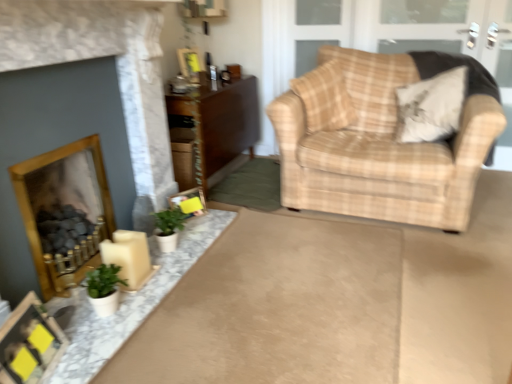
Image resolution: width=512 pixels, height=384 pixels. I want to click on free space in front of green matte plant at lower left, positioned as the second houseplant in front-to-back order, so click(169, 259).